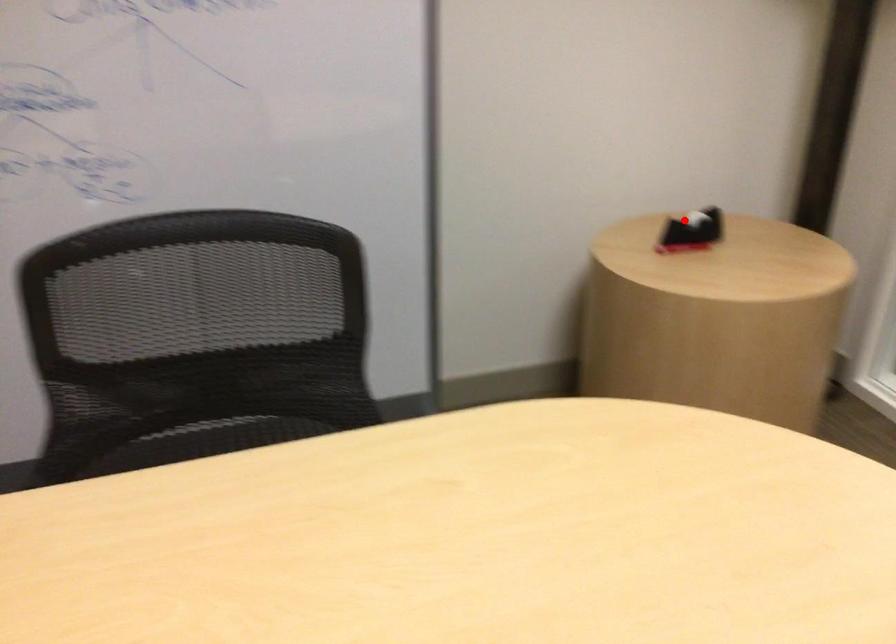
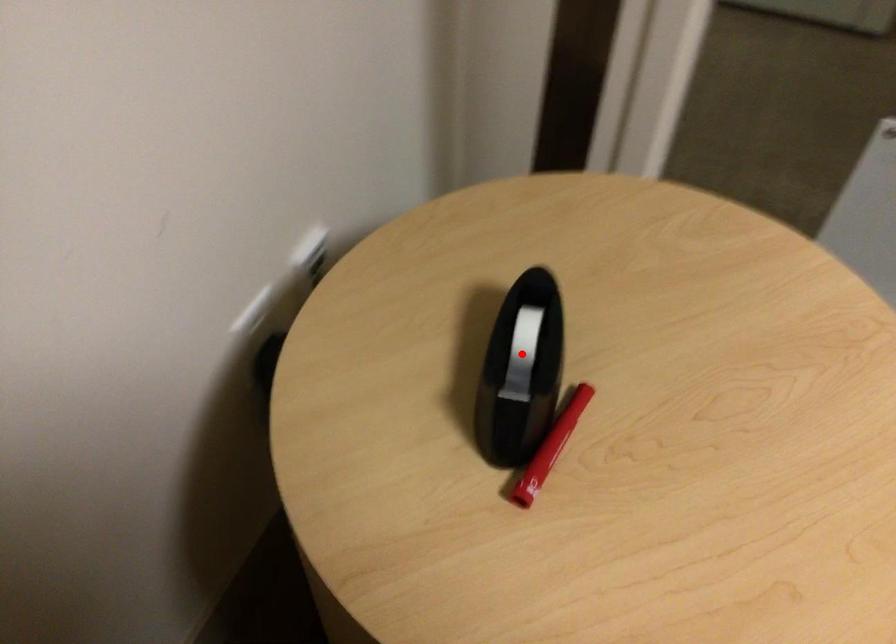
I am providing you with two images of the same scene from different viewpoints. A red point is marked on the first image and another point is marked on the second image. Do the highlighted points in image1 and image2 indicate the same real-world spot?

Yes